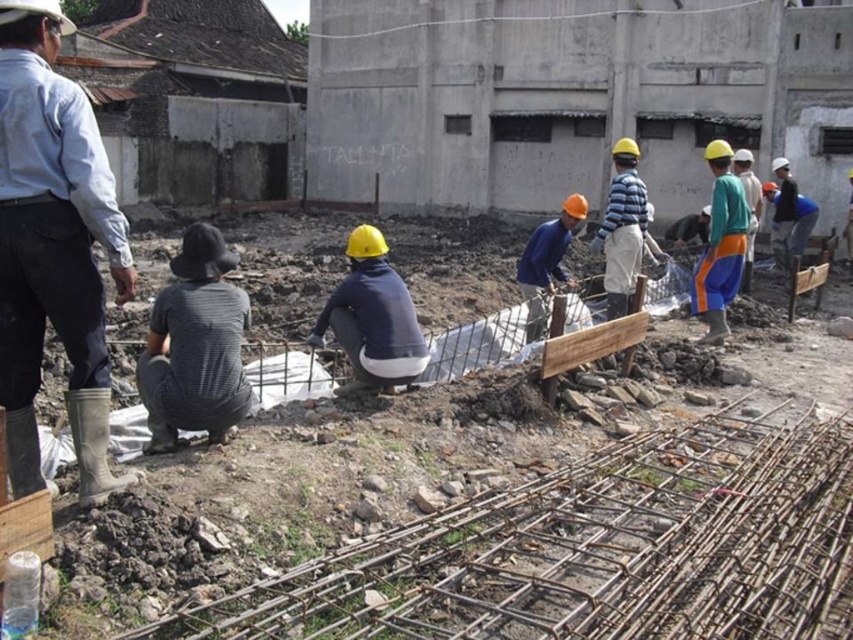
Is green fabric pants at right thinner than orange fabric pants at center?

In fact, green fabric pants at right might be wider than orange fabric pants at center.

Is point (737, 228) positioned in front of point (683, 237)?

Yes, it is.

Between point (722, 182) and point (670, 241), which one is positioned behind?

The point (670, 241) is more distant.

Locate an element on the screen. The image size is (853, 640). green fabric pants at right is located at coordinates (720, 244).

Is matte blue shirt at center to the left of green fabric pants at right from the viewer's perspective?

Yes, matte blue shirt at center is to the left of green fabric pants at right.

Between matte blue shirt at center and green fabric pants at right, which one has more height?

Standing taller between the two is green fabric pants at right.

What do you see at coordinates (373, 316) in the screenshot? I see `matte blue shirt at center` at bounding box center [373, 316].

Image resolution: width=853 pixels, height=640 pixels. What are the coordinates of `matte blue shirt at center` in the screenshot? It's located at (373, 316).

Does dark gray cotton shirt at lower left have a lesser height compared to blue matte shirt at center?

In fact, dark gray cotton shirt at lower left may be taller than blue matte shirt at center.

Which is below, dark gray cotton shirt at lower left or blue matte shirt at center?

dark gray cotton shirt at lower left is below.

The height and width of the screenshot is (640, 853). Find the location of `dark gray cotton shirt at lower left`. dark gray cotton shirt at lower left is located at coordinates pos(195,346).